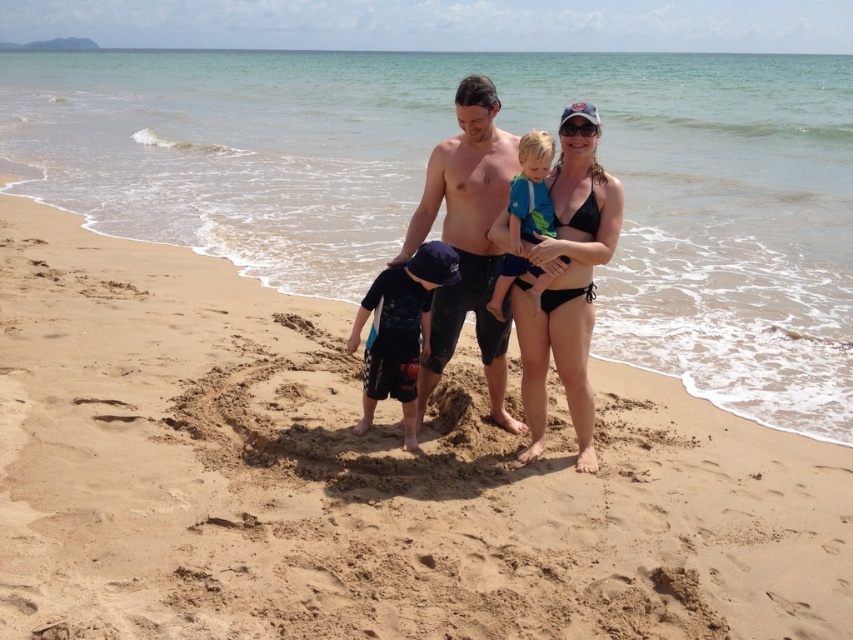
Does point (223, 497) lie in front of point (577, 260)?

Yes, it is in front of point (577, 260).

Between brown sandy beach at center and black bikini at center, which one appears on the right side from the viewer's perspective?

Positioned to the right is black bikini at center.

Locate an element on the screen. The height and width of the screenshot is (640, 853). brown sandy beach at center is located at coordinates (363, 480).

Does shiny skin man at center have a greater height compared to blue fabric shirt at center?

Correct, shiny skin man at center is much taller as blue fabric shirt at center.

The height and width of the screenshot is (640, 853). In order to click on shiny skin man at center in this screenshot , I will do `click(467, 240)`.

Measure the distance between shiny skin man at center and camera.

5.36 meters

Is point (461, 182) positioned behind point (583, 131)?

Yes, it is behind point (583, 131).

Locate an element on the screen. shiny skin man at center is located at coordinates (467, 240).